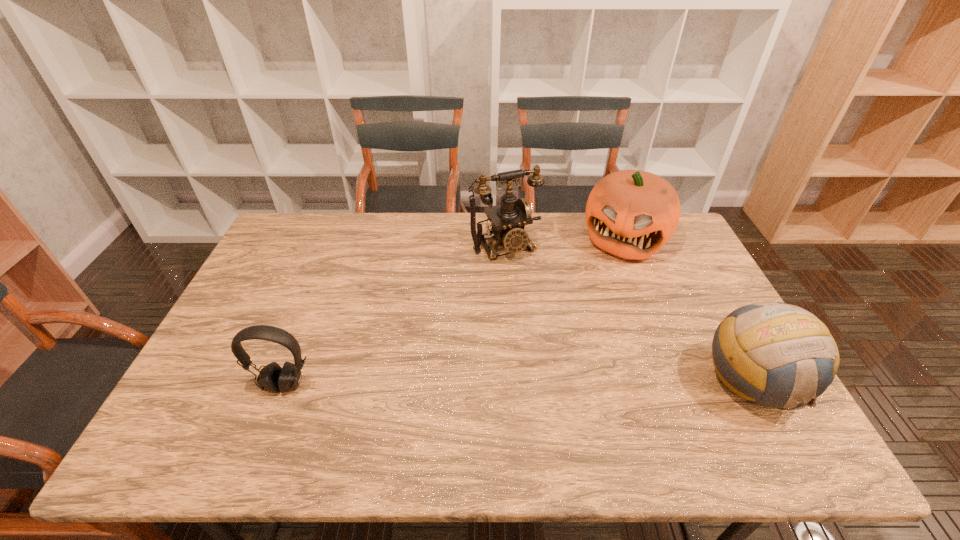
Identify the location of free space located on the face of the pumpkin. The height and width of the screenshot is (540, 960). (576, 349).

Where is `telephone that is positioned at the far edge`? Image resolution: width=960 pixels, height=540 pixels. telephone that is positioned at the far edge is located at coordinates (508, 219).

Where is `pumpkin situated at the far edge`? The height and width of the screenshot is (540, 960). pumpkin situated at the far edge is located at coordinates (631, 214).

At what (x,y) coordinates should I click in order to perform the action: click on headset at the near edge. Please return your answer as a coordinate pair (x, y). This screenshot has width=960, height=540. Looking at the image, I should click on (272, 378).

The height and width of the screenshot is (540, 960). Find the location of `volleyball present at the near edge`. volleyball present at the near edge is located at coordinates (774, 354).

This screenshot has width=960, height=540. I want to click on object that is at the left edge, so click(272, 378).

This screenshot has height=540, width=960. What are the coordinates of `volleyball that is at the right edge` in the screenshot? It's located at (774, 354).

Locate an element on the screen. The height and width of the screenshot is (540, 960). pumpkin located at the right edge is located at coordinates (631, 214).

Where is `object that is at the near left corner`? object that is at the near left corner is located at coordinates (272, 378).

In order to click on object situated at the far right corner in this screenshot , I will do `click(631, 214)`.